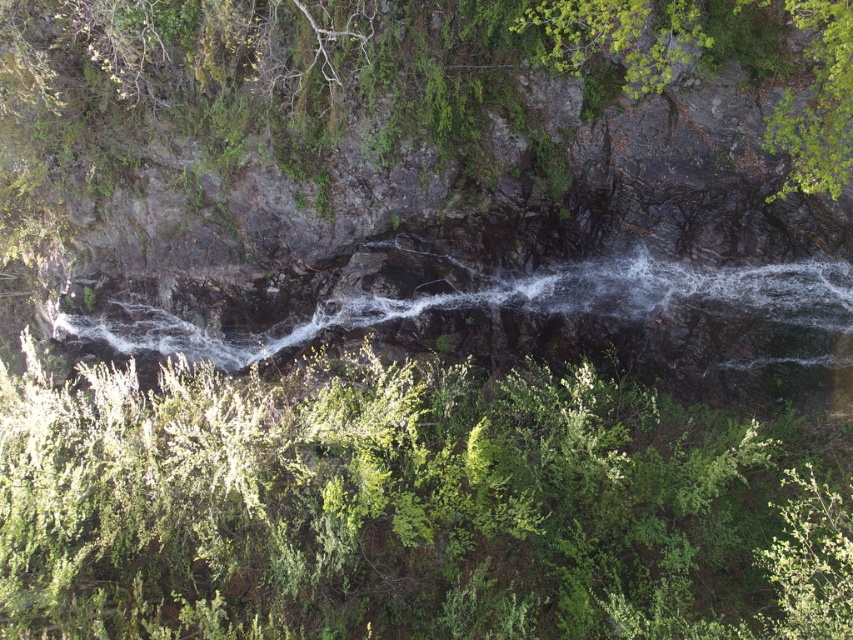
Question: From the image, what is the correct spatial relationship of green leafy shrub at upper center in relation to white frothy water at center?

Choices:
 (A) left
 (B) right

Answer: (A)

Question: Can you confirm if green leafy shrub at upper center is wider than white frothy water at center?

Choices:
 (A) yes
 (B) no

Answer: (A)

Question: Among these objects, which one is farthest from the camera?

Choices:
 (A) green leafy shrub at upper center
 (B) white frothy water at center

Answer: (B)

Question: Which point is closer to the camera?

Choices:
 (A) green leafy shrub at upper center
 (B) white frothy water at center

Answer: (A)

Question: Which point is closer to the camera?

Choices:
 (A) green leafy shrub at upper center
 (B) white frothy water at center

Answer: (A)

Question: Is green leafy shrub at upper center above white frothy water at center?

Choices:
 (A) no
 (B) yes

Answer: (A)